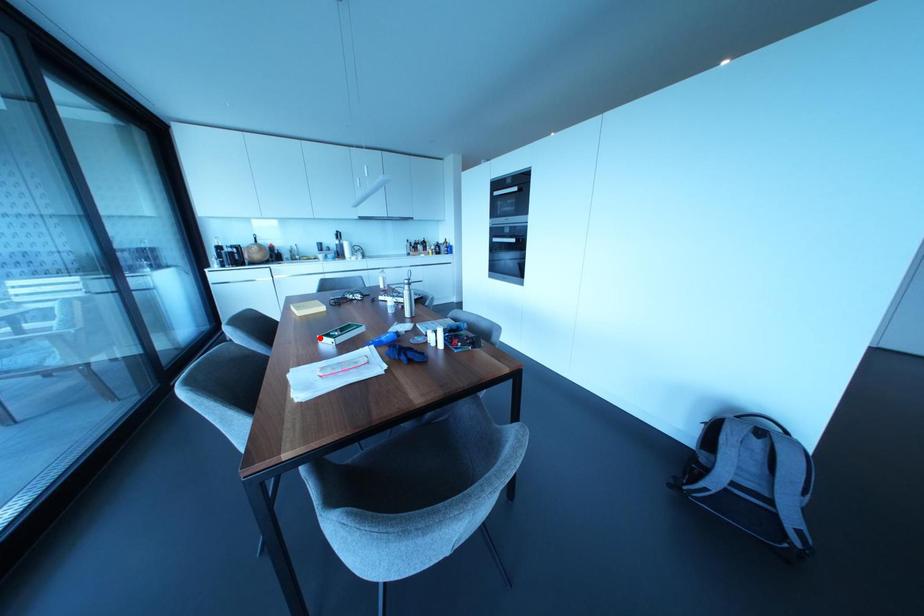
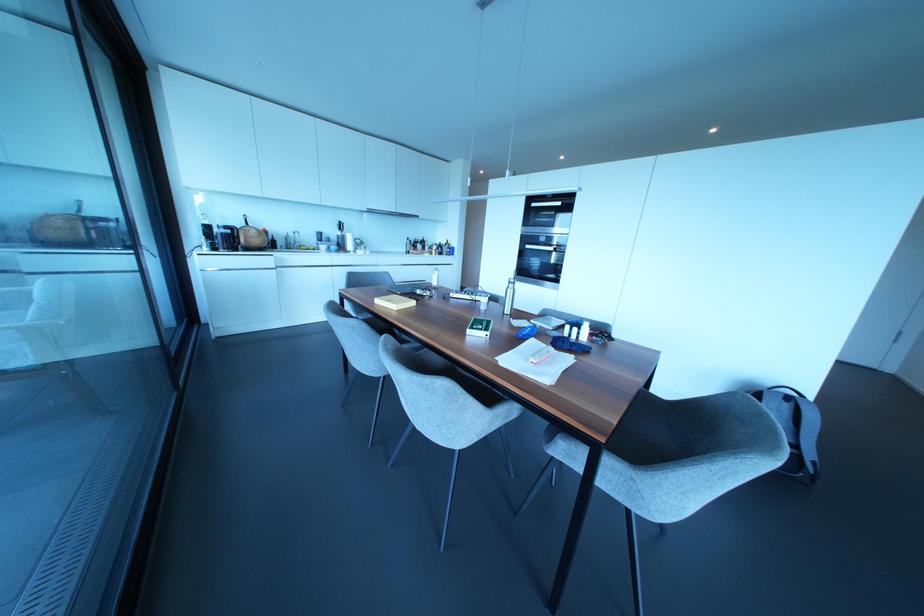
Locate, in the second image, the point that corresponds to the highlighted location in the first image.

(468, 331)